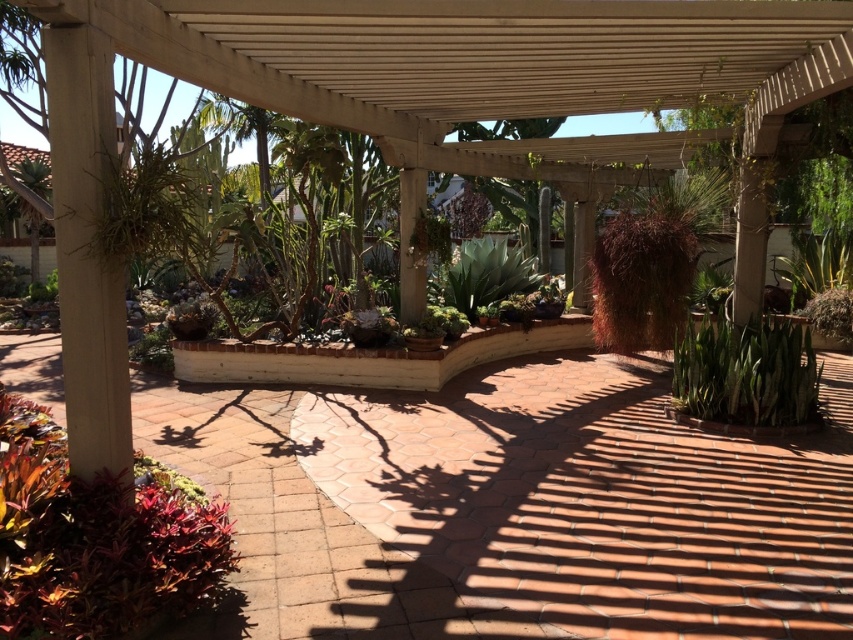
Describe the element at coordinates (746, 372) in the screenshot. I see `green leafy plant at right` at that location.

Which of these two, green leafy plant at right or green succulent at center, stands shorter?

With less height is green leafy plant at right.

Who is more forward, [718,372] or [456,307]?

Point [718,372]

Find the location of a particular element. The image size is (853, 640). green leafy plant at right is located at coordinates (746, 372).

Which is below, terracotta tile path at center or green succulent at center?

terracotta tile path at center is below.

From the picture: How far apart are terracotta tile path at center and green succulent at center?

terracotta tile path at center is 6.01 meters from green succulent at center.

Between point (366, 404) and point (460, 307), which one is positioned behind?

The point (460, 307) is behind.

Locate an element on the screen. This screenshot has width=853, height=640. terracotta tile path at center is located at coordinates (514, 508).

Is point (9, 420) in front of point (456, 304)?

Yes, it is in front of point (456, 304).

Consider the image. Who is higher up, multicolored leafy plant at lower left or green succulent at center?

Positioned higher is green succulent at center.

Where is `multicolored leafy plant at lower left`? This screenshot has width=853, height=640. multicolored leafy plant at lower left is located at coordinates (96, 538).